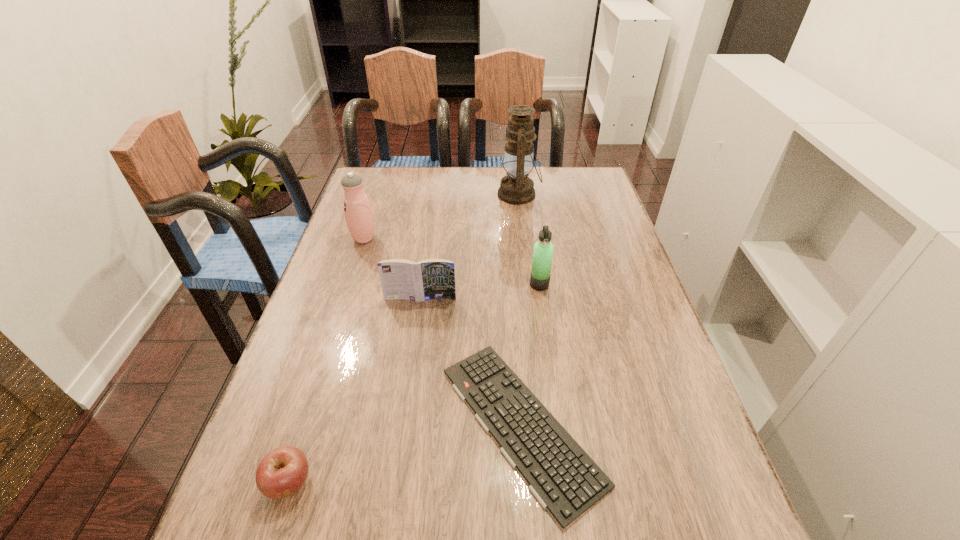
This screenshot has height=540, width=960. I want to click on oil lamp, so click(516, 188).

Identify the location of the tallest object. The image size is (960, 540). (516, 188).

At what (x,y) coordinates should I click in order to perform the action: click on the left thermos bottle. Please return your answer as a coordinate pair (x, y). This screenshot has height=540, width=960. Looking at the image, I should click on (359, 217).

This screenshot has height=540, width=960. Identify the location of the farther thermos bottle. [x=359, y=217].

Find the location of a particular element. This screenshot has height=540, width=960. the third farthest object is located at coordinates (543, 249).

At what (x,y) coordinates should I click in order to perform the action: click on the right thermos bottle. Please return your answer as a coordinate pair (x, y). Looking at the image, I should click on (543, 249).

Find the location of a particular element. The image size is (960, 540). book is located at coordinates (428, 279).

Find the location of a particular element. This screenshot has height=540, width=960. the fourth farthest object is located at coordinates (428, 279).

Identify the location of the second shortest object. (283, 471).

Identify the location of computer keyboard. The height and width of the screenshot is (540, 960). (564, 479).